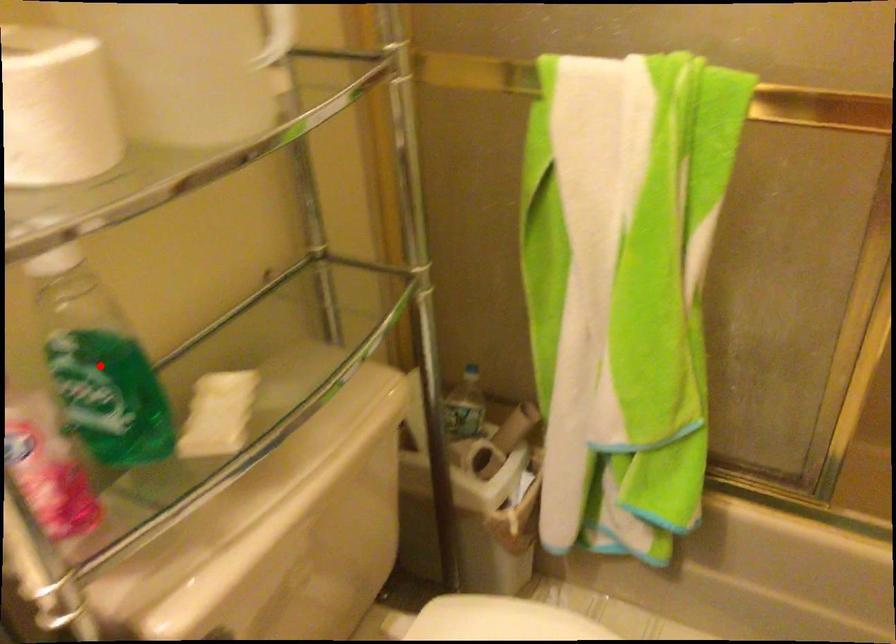
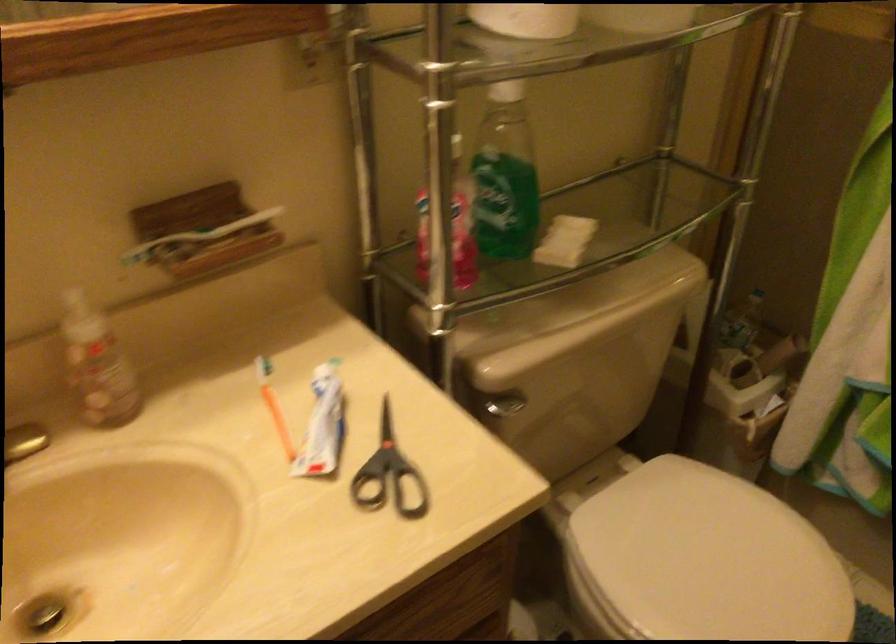
The point at the highlighted location is marked in the first image. Where is the corresponding point in the second image?

(504, 176)